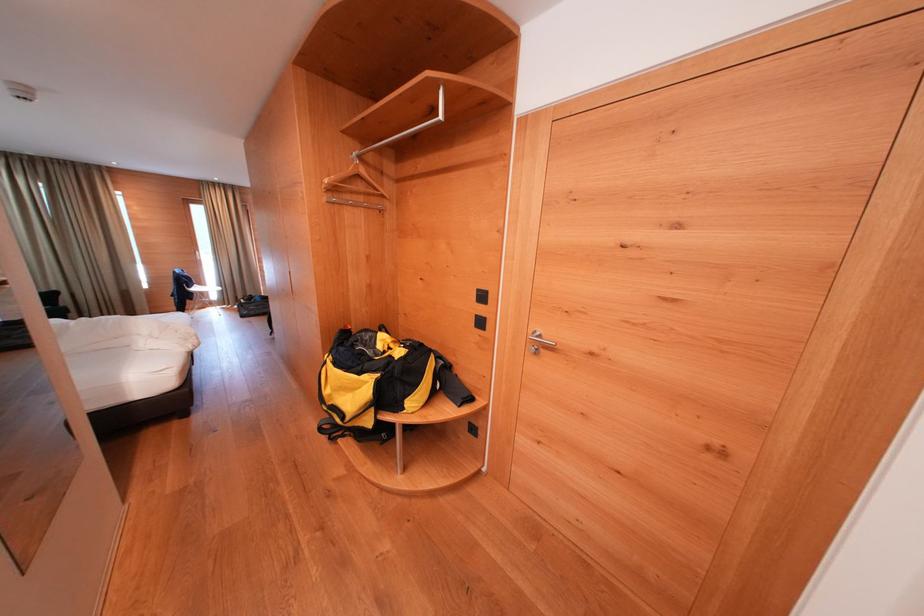
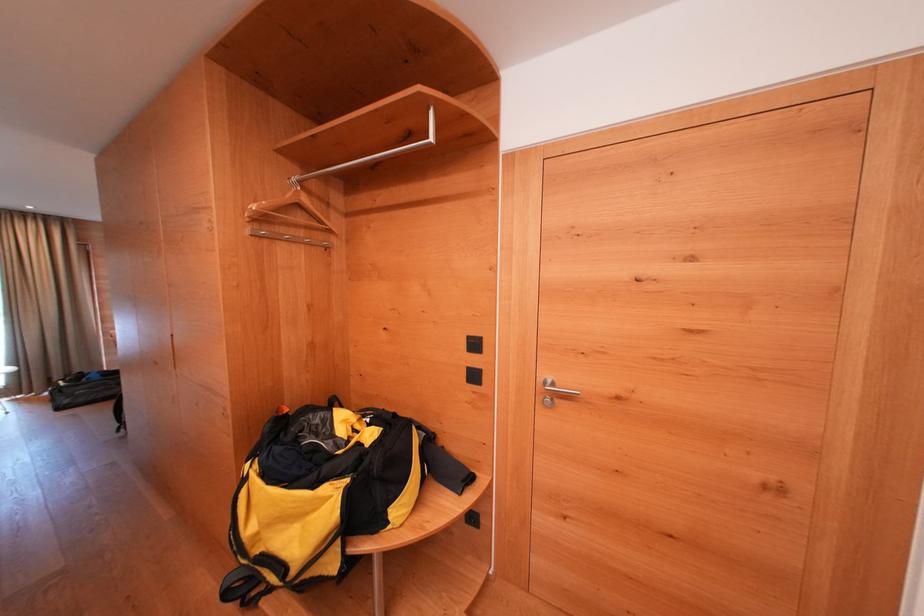
The point at (370, 176) is marked in the first image. Where is the corresponding point in the second image?

(312, 205)